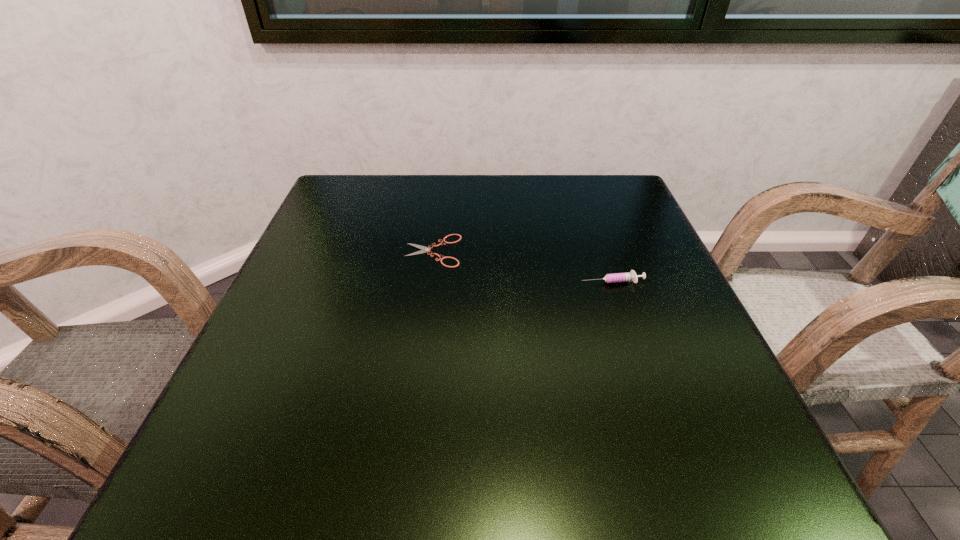
In the image, there is a desktop. At what (x,y) coordinates should I click in order to perform the action: click on vacant space at the right edge. Please return your answer as a coordinate pair (x, y). Looking at the image, I should click on (684, 314).

Image resolution: width=960 pixels, height=540 pixels. In the image, there is a desktop. Identify the location of vacant space at the far left corner. 357,204.

Locate an element on the screen. The image size is (960, 540). vacant space at the far right corner is located at coordinates (585, 177).

Find the location of `free space at the near right corner`. free space at the near right corner is located at coordinates (774, 477).

Identify the location of blank area in the image that satisfies the following two spatial constraints: 1. on the front side of the shorter object; 2. on the right side of the nearer object. click(429, 281).

Locate an element on the screen. The height and width of the screenshot is (540, 960). free spot that satisfies the following two spatial constraints: 1. on the front side of the shorter object; 2. on the right side of the nearer object is located at coordinates (429, 281).

At what (x,y) coordinates should I click in order to perform the action: click on vacant region that satisfies the following two spatial constraints: 1. on the front side of the nearer object; 2. on the left side of the farther object. Please return your answer as a coordinate pair (x, y). Image resolution: width=960 pixels, height=540 pixels. Looking at the image, I should click on (429, 281).

In order to click on vacant space that satisfies the following two spatial constraints: 1. on the front side of the farther object; 2. on the left side of the nearer object in this screenshot , I will do `click(429, 281)`.